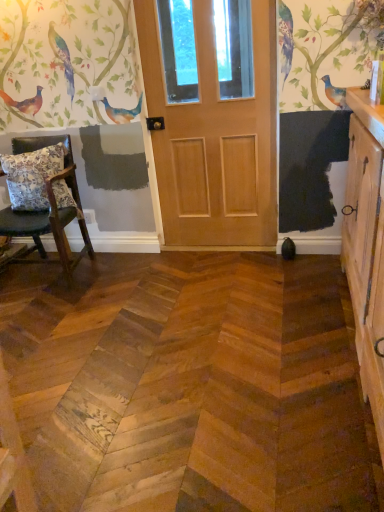
Question: From the image's perspective, is natural wood door at center located beneath floral fabric cushion at left?

Choices:
 (A) no
 (B) yes

Answer: (A)

Question: Is the depth of natural wood door at center greater than that of floral fabric cushion at left?

Choices:
 (A) no
 (B) yes

Answer: (A)

Question: Is natural wood door at center not inside floral fabric cushion at left?

Choices:
 (A) yes
 (B) no

Answer: (A)

Question: Could floral fabric cushion at left be considered to be inside natural wood door at center?

Choices:
 (A) no
 (B) yes

Answer: (A)

Question: Can you confirm if natural wood door at center is thinner than floral fabric cushion at left?

Choices:
 (A) yes
 (B) no

Answer: (A)

Question: Considering the relative sizes of natural wood door at center and floral fabric cushion at left in the image provided, is natural wood door at center taller than floral fabric cushion at left?

Choices:
 (A) no
 (B) yes

Answer: (B)

Question: From the image's perspective, is wooden cabinet at right located beneath wooden chair with cushion at left?

Choices:
 (A) no
 (B) yes

Answer: (B)

Question: Is wooden chair with cushion at left at the back of wooden cabinet at right?

Choices:
 (A) no
 (B) yes

Answer: (A)

Question: Is wooden cabinet at right placed right next to wooden chair with cushion at left?

Choices:
 (A) no
 (B) yes

Answer: (A)

Question: Does wooden cabinet at right have a lesser height compared to wooden chair with cushion at left?

Choices:
 (A) no
 (B) yes

Answer: (A)

Question: From a real-world perspective, is wooden cabinet at right physically below wooden chair with cushion at left?

Choices:
 (A) yes
 (B) no

Answer: (B)

Question: Is wooden cabinet at right surrounding wooden chair with cushion at left?

Choices:
 (A) no
 (B) yes

Answer: (A)

Question: Are wooden cabinet at right and floral fabric cushion at left located far from each other?

Choices:
 (A) yes
 (B) no

Answer: (A)